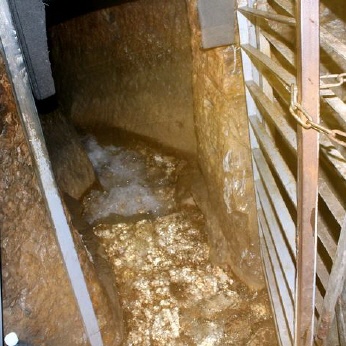
Where is `wall`? Image resolution: width=346 pixels, height=346 pixels. wall is located at coordinates [x=153, y=41].